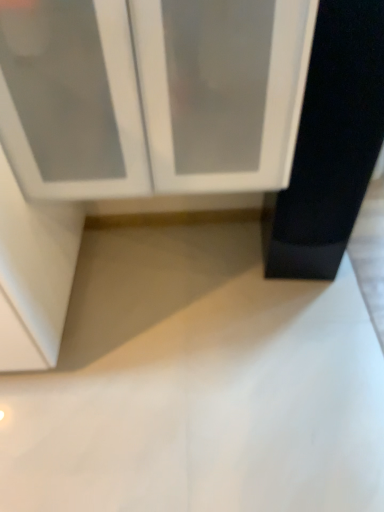
What are the coordinates of `white glossy cabinet at upper center` in the screenshot? It's located at (118, 137).

Describe the element at coordinates (118, 137) in the screenshot. I see `white glossy cabinet at upper center` at that location.

Image resolution: width=384 pixels, height=512 pixels. In order to click on white glossy cabinet at upper center in this screenshot , I will do `click(118, 137)`.